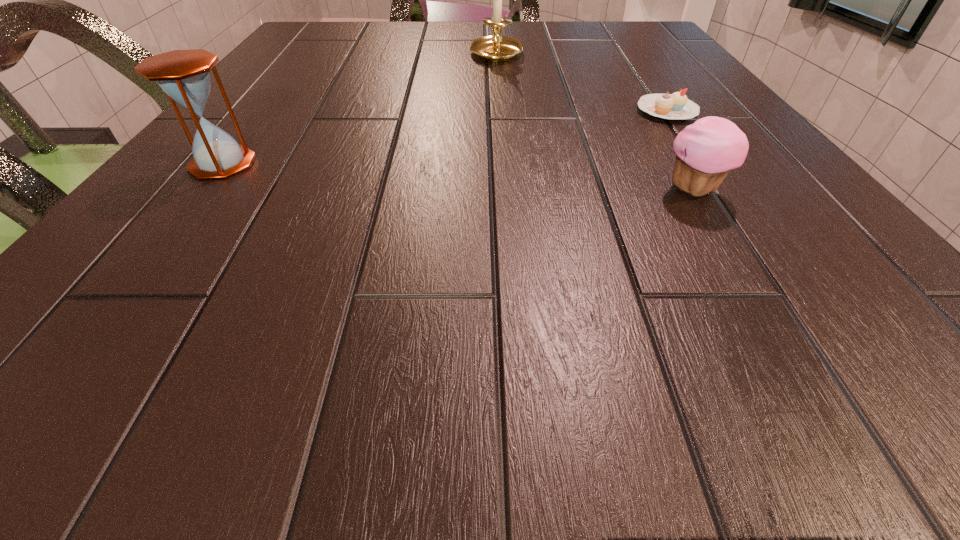
Identify the location of free space located 0.270m on the front of the third nearest object. The image size is (960, 540). (743, 224).

You are a GUI agent. You are given a task and a screenshot of the screen. Output one action in this format:
    pyautogui.click(x=<x>, y=<y>)
    Task: Click on the object at the far edge
    This screenshot has width=960, height=540.
    Given the screenshot: What is the action you would take?
    pyautogui.click(x=496, y=48)

I want to click on object that is positioned at the left edge, so click(184, 76).

This screenshot has width=960, height=540. In the image, there is a desktop. What are the coordinates of `free space at the far edge` in the screenshot? It's located at (425, 34).

This screenshot has width=960, height=540. Find the location of `free space at the near edge of the desktop`. free space at the near edge of the desktop is located at coordinates (644, 337).

In the image, there is a desktop. Identify the location of free region at the left edge. This screenshot has width=960, height=540. (190, 245).

Where is `free space at the right edge`? The width and height of the screenshot is (960, 540). free space at the right edge is located at coordinates (883, 299).

Where is `free space at the far left corner`? This screenshot has width=960, height=540. free space at the far left corner is located at coordinates (321, 29).

At what (x,y) coordinates should I click in order to perform the action: click on vacant area between the farthest object and the nearer cupcake. Please return your answer as a coordinate pair (x, y). This screenshot has height=540, width=960. Looking at the image, I should click on (595, 122).

Find the location of `vacant point located between the shorter cupcake and the hourglass`. vacant point located between the shorter cupcake and the hourglass is located at coordinates (444, 137).